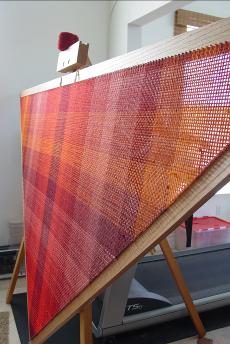
In order to click on wooden windowsill in this screenshot , I will do `click(191, 17)`.